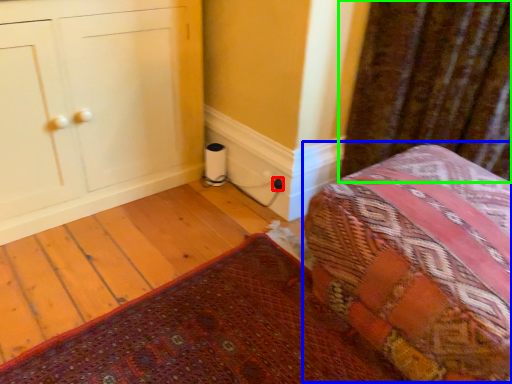
Question: Estimate the real-world distances between objects in this image. Which object is farther from electric outlet (highlighted by a red box), bed (highlighted by a blue box) or curtain (highlighted by a green box)?

Choices:
 (A) bed
 (B) curtain

Answer: (A)